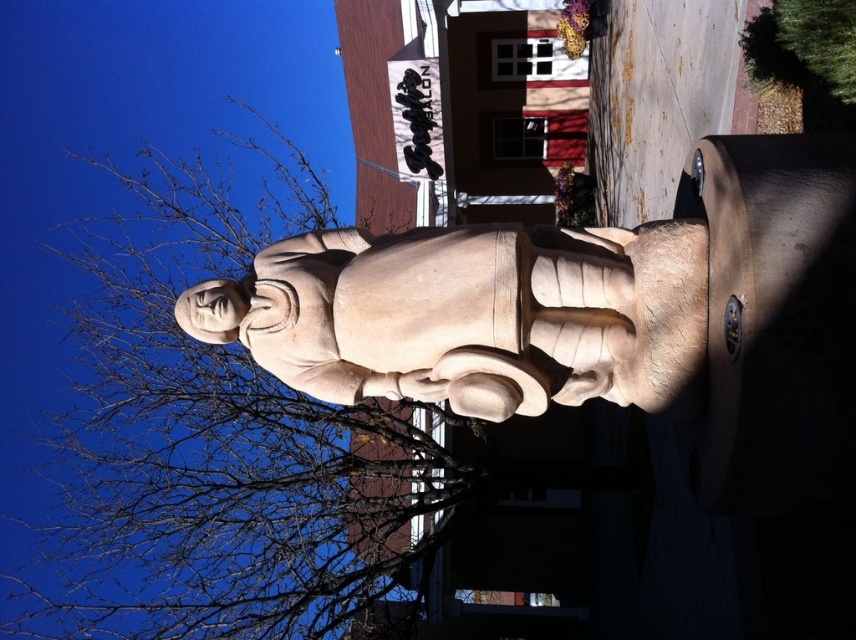
You are standing in front of the statue and looking towards the Galleria building. Where is the point marked by coordinates point [220,442] located in relation to the statue?

The point marked by coordinates point [220,442] is located at the upper left, marking the position of bare branches.

You are an artist planning to paint the scene in front of you. You notice the bare branches at upper left and the smooth beige statue at center. Which object should you depict as bigger in your painting to stay true to the actual view?

You should depict the bare branches at upper left as bigger in your painting because the bare branches at upper left is larger in size than the smooth beige statue at center.